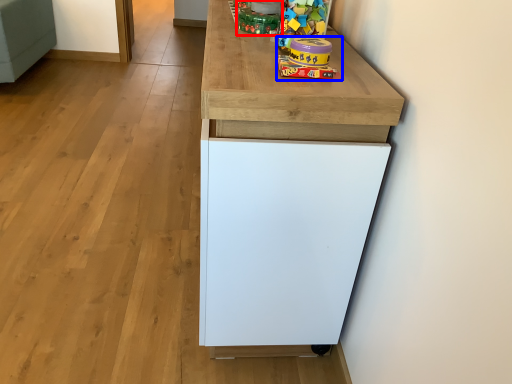
Question: Which object is closer to the camera taking this photo, toy (highlighted by a red box) or toy (highlighted by a blue box)?

Choices:
 (A) toy
 (B) toy

Answer: (B)